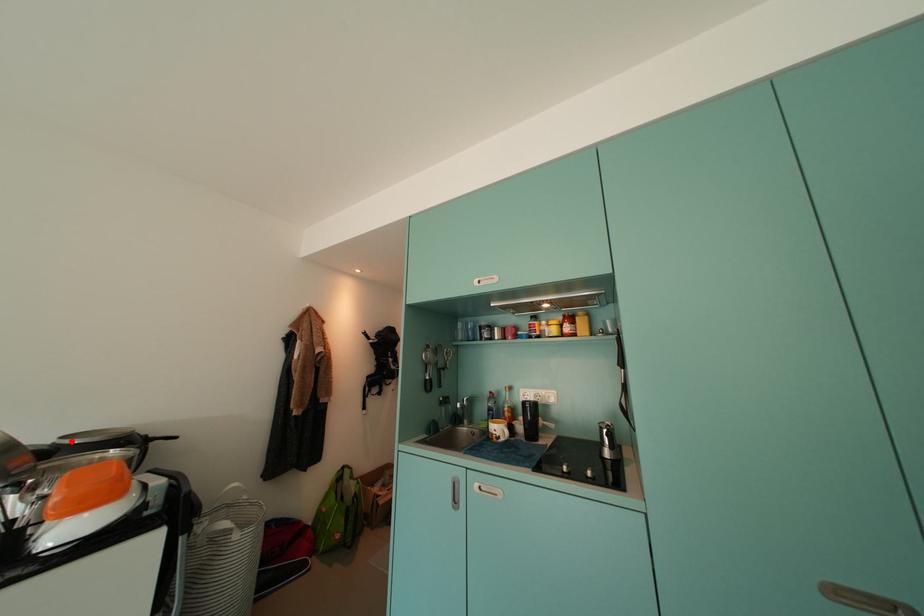
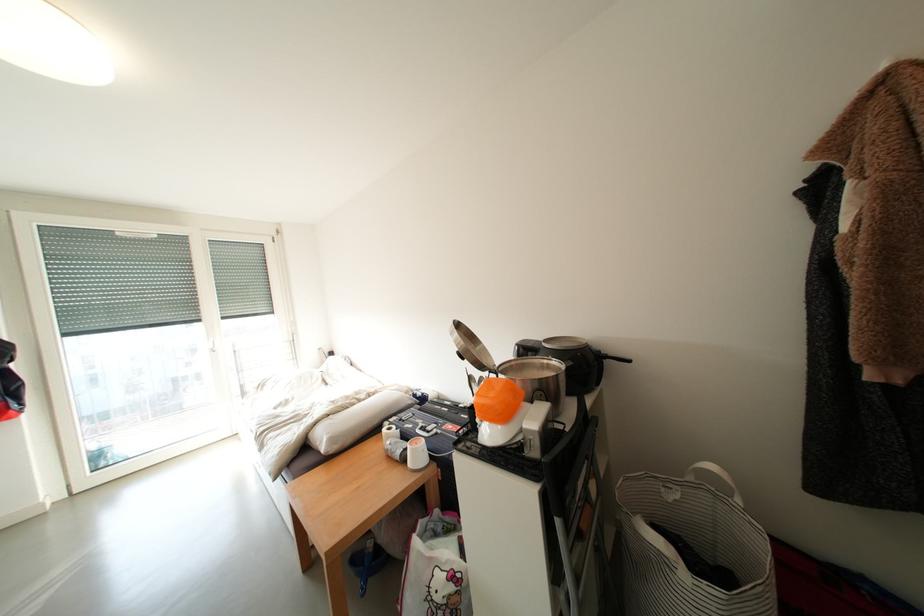
Locate, in the second image, the point that corresponds to the highlighted location in the first image.

(553, 344)